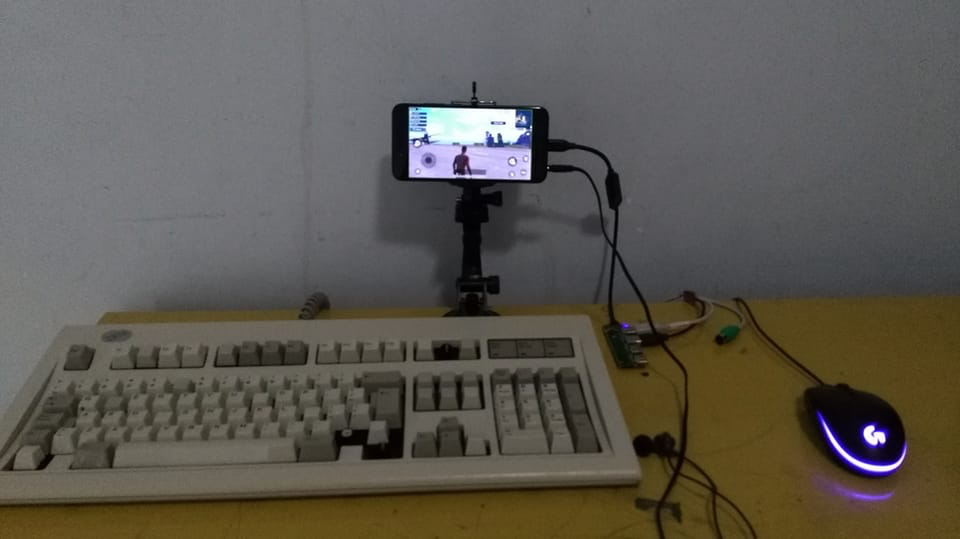
Identify the location of gaming mouse. The height and width of the screenshot is (539, 960). (843, 407).